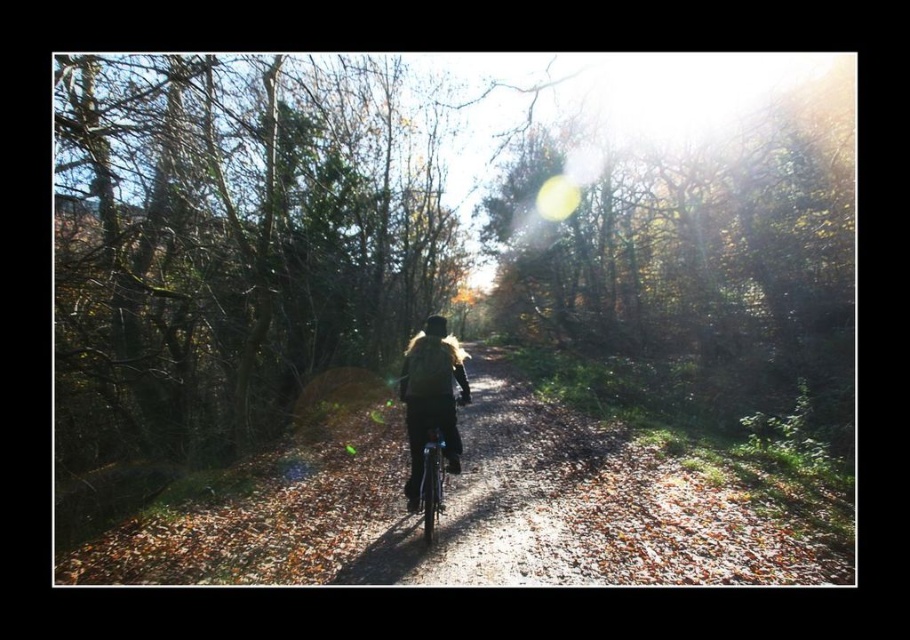
You are standing at the point with coordinates (493, 499) in the image. What object is located exactly at this point?

The matte black bicycle at center is located exactly at the point with coordinates (493, 499).

You are planning to ride the matte black bicycle at center while wearing the fuzzy black jacket at center. Considering the width of both items, will the jacket interfere with your ability to ride comfortably?

The matte black bicycle at center might be wider than fuzzy black jacket at center, so there is a possibility that the jacket could interfere with riding comfort if it is wider than the jacket. However, since the exact width difference isn not specified, it is recommended to check the actual dimensions before riding.